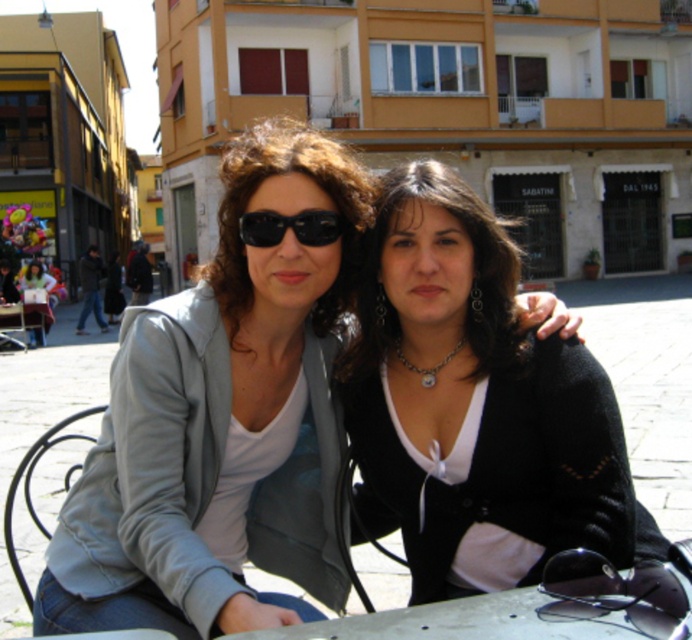
Consider the image. Between black reflective goggles at lower right and metallic silver table at lower left, which one is positioned lower?

black reflective goggles at lower right is below.

This screenshot has width=692, height=640. In order to click on black reflective goggles at lower right in this screenshot , I will do [x=617, y=593].

Identify the location of black reflective goggles at lower right. (617, 593).

Between black reflective goggles at lower right and black plastic sunglasses at upper center, which one is positioned higher?

black plastic sunglasses at upper center is higher up.

What do you see at coordinates (617, 593) in the screenshot?
I see `black reflective goggles at lower right` at bounding box center [617, 593].

Does point (563, 561) lie behind point (264, 225)?

No, it is not.

The width and height of the screenshot is (692, 640). Identify the location of black reflective goggles at lower right. (617, 593).

Is matte black sunglasses at center thinner than silver/glassy necklace at center?

No.

Which is more to the right, matte black sunglasses at center or silver/glassy necklace at center?

silver/glassy necklace at center is more to the right.

This screenshot has height=640, width=692. What do you see at coordinates (254, 193) in the screenshot? I see `matte black sunglasses at center` at bounding box center [254, 193].

Locate an element on the screen. Image resolution: width=692 pixels, height=640 pixels. matte black sunglasses at center is located at coordinates (254, 193).